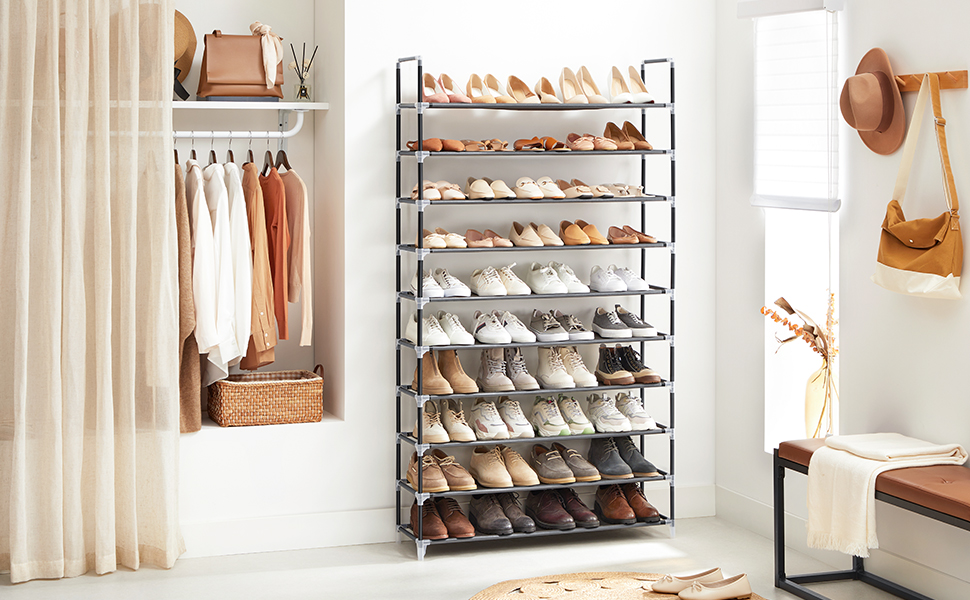
Locate an element on the screen. This screenshot has height=600, width=970. wood hanger part is located at coordinates (284, 158), (270, 162), (250, 157), (228, 159), (211, 159), (190, 159), (172, 156).